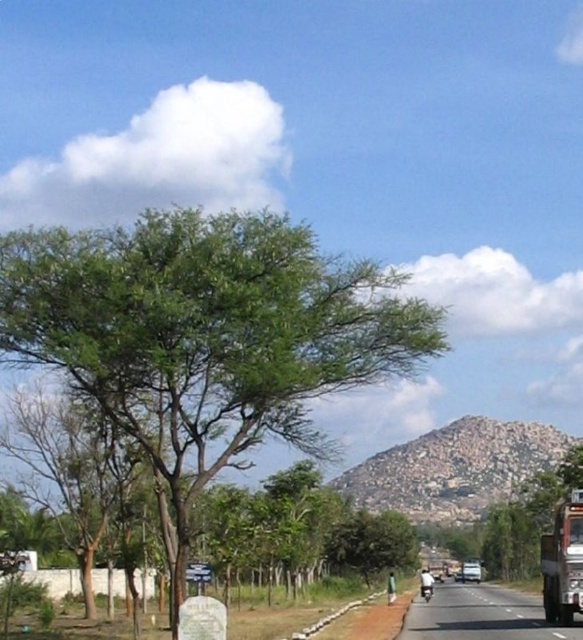
Question: Does green leafy tree at center come in front of metallic silver trailer truck at right?

Choices:
 (A) yes
 (B) no

Answer: (A)

Question: Is the position of black asphalt road at center more distant than that of metallic silver trailer truck at right?

Choices:
 (A) no
 (B) yes

Answer: (A)

Question: Which point is closer to the camera?

Choices:
 (A) (433, 634)
 (B) (26, 337)

Answer: (B)

Question: From the image, what is the correct spatial relationship of green leafy tree at center in relation to metallic silver trailer truck at right?

Choices:
 (A) right
 (B) left

Answer: (B)

Question: Among these objects, which one is nearest to the camera?

Choices:
 (A) green leafy tree at center
 (B) black asphalt road at center
 (C) metallic silver trailer truck at right

Answer: (A)

Question: Considering the real-world distances, which object is farthest from the black asphalt road at center?

Choices:
 (A) metallic silver trailer truck at right
 (B) green leafy tree at center

Answer: (B)